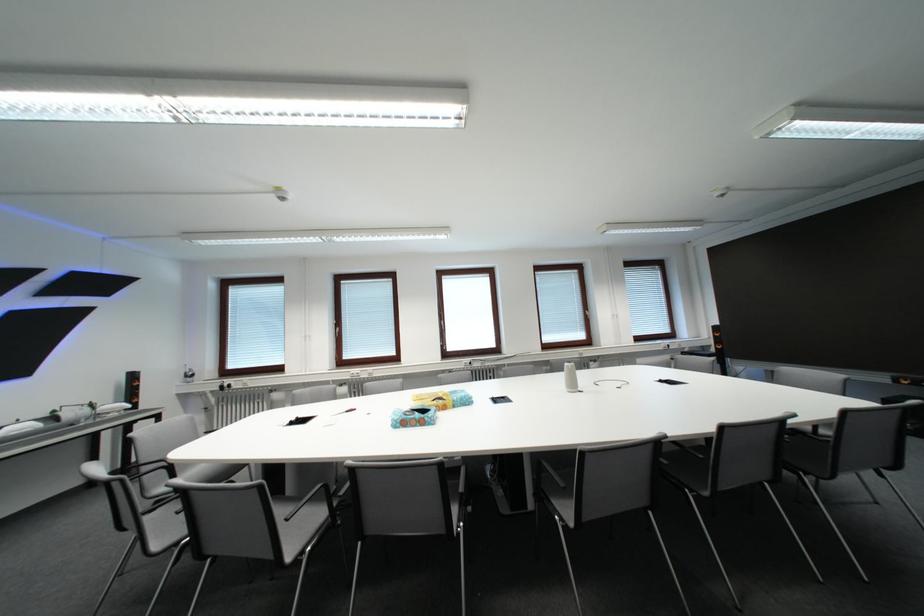
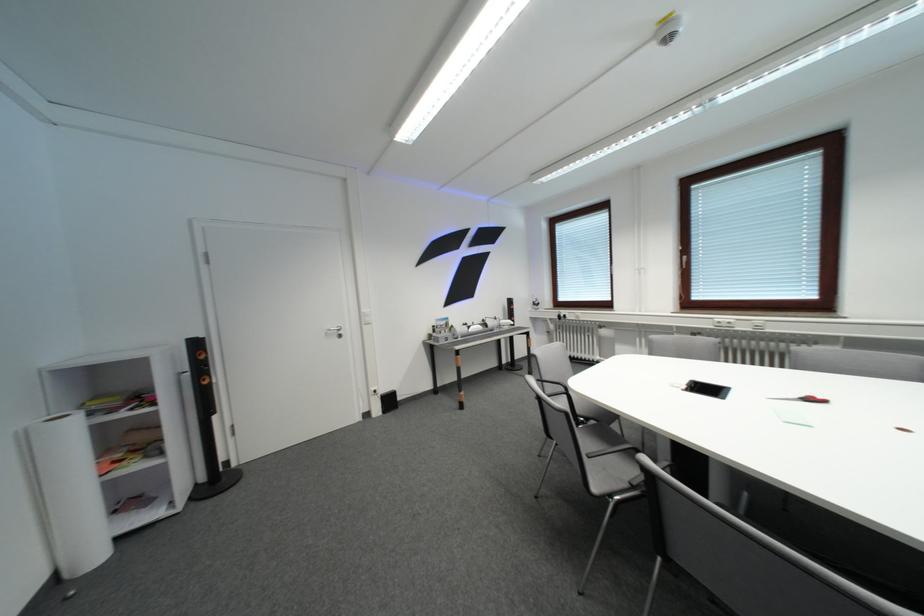
Question: The camera is either moving clockwise (left) or counter-clockwise (right) around the object. The first image is from the beginning of the video and the second image is from the end. Is the camera moving left or right when shooting the video?

Choices:
 (A) Left
 (B) Right

Answer: (B)